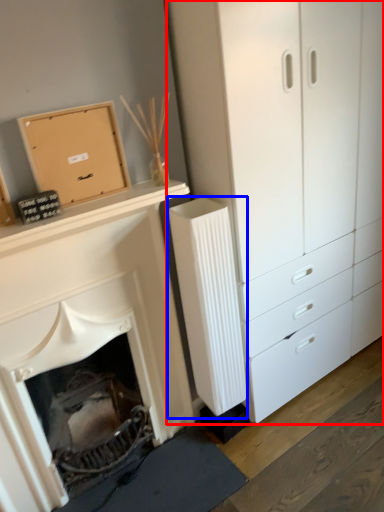
Question: Which point is further to the camera, chest of drawers (highlighted by a red box) or radiator (highlighted by a blue box)?

Choices:
 (A) chest of drawers
 (B) radiator

Answer: (B)